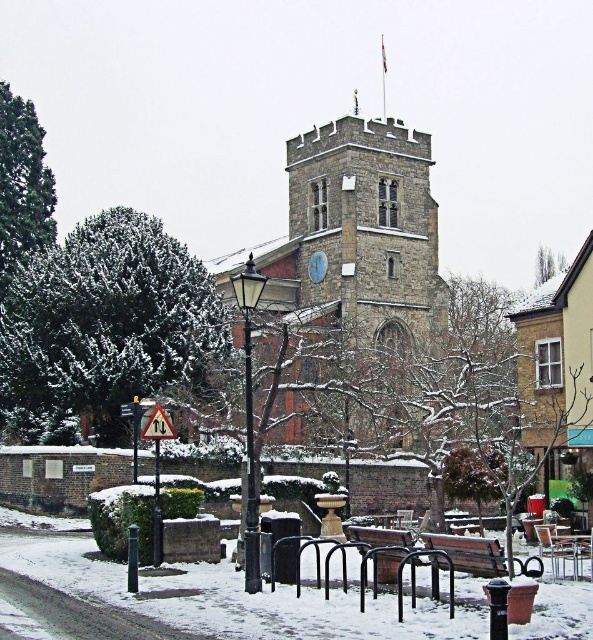
How distant is stone clock tower at center from wooden bench at center?

stone clock tower at center is 169.35 feet from wooden bench at center.

Can you confirm if stone clock tower at center is wider than wooden bench at center?

Yes, stone clock tower at center is wider than wooden bench at center.

Is point (298, 266) farther from viewer compared to point (521, 568)?

Yes.

You are a GUI agent. You are given a task and a screenshot of the screen. Output one action in this format:
    pyautogui.click(x=<x>, y=<y>)
    Task: Click on the stone clock tower at center
    Image resolution: width=593 pixels, height=640 pixels.
    Given the screenshot: What is the action you would take?
    pyautogui.click(x=352, y=250)

Is the position of stone clock tower at center less distant than that of wooden park bench at center?

That is False.

Who is shorter, stone clock tower at center or wooden park bench at center?

wooden park bench at center is shorter.

The image size is (593, 640). Identify the location of stone clock tower at center. (352, 250).

Consider the image. Which of these two, wooden bench at center or wooden park bench at center, stands taller?

wooden park bench at center

Measure the distance between point (503,560) and camera.

94.45 feet

Is point (470, 560) closer to camera compared to point (396, 563)?

Yes, point (470, 560) is closer to viewer.

Identify the location of wooden bench at center. The height and width of the screenshot is (640, 593). (470, 554).